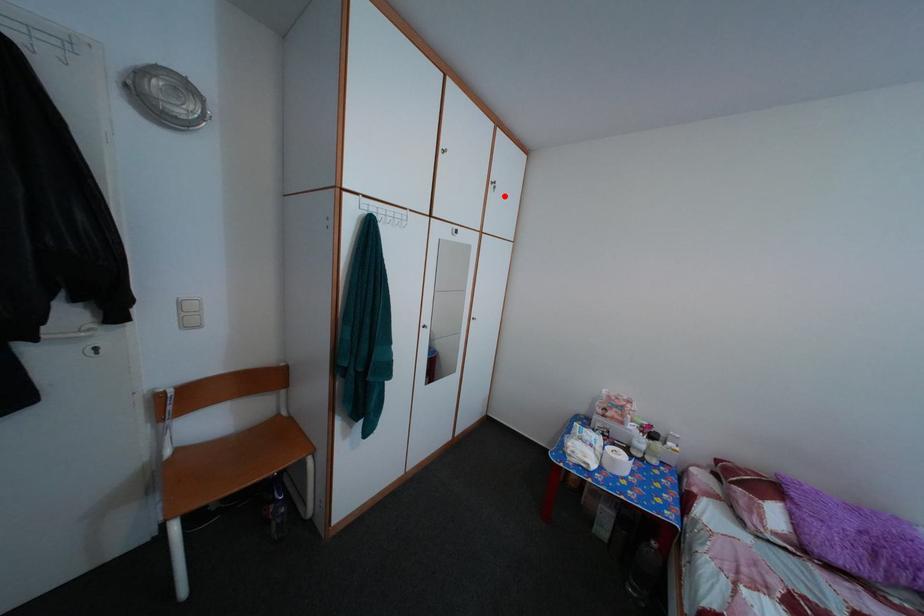
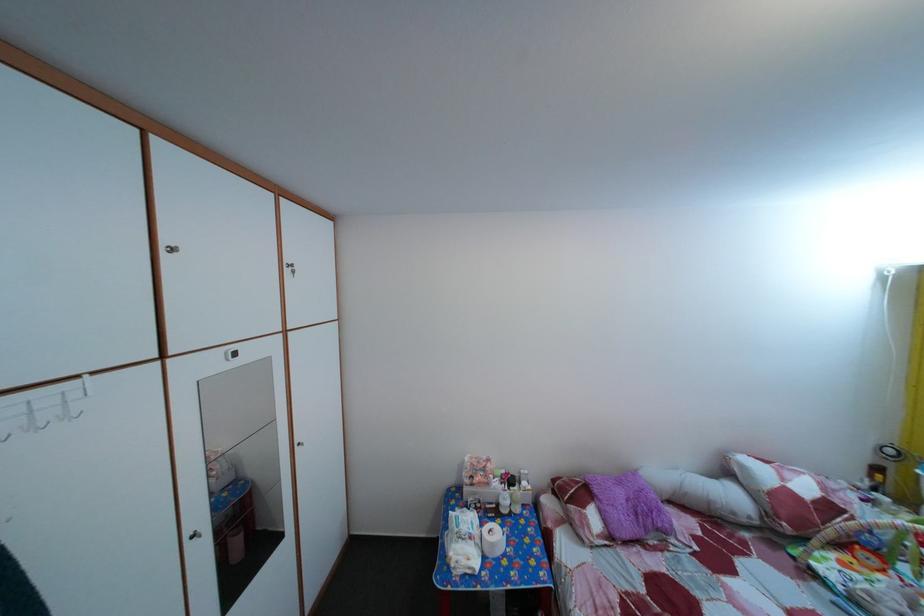
The point at the highlighted location is marked in the first image. Where is the corresponding point in the second image?

(304, 280)